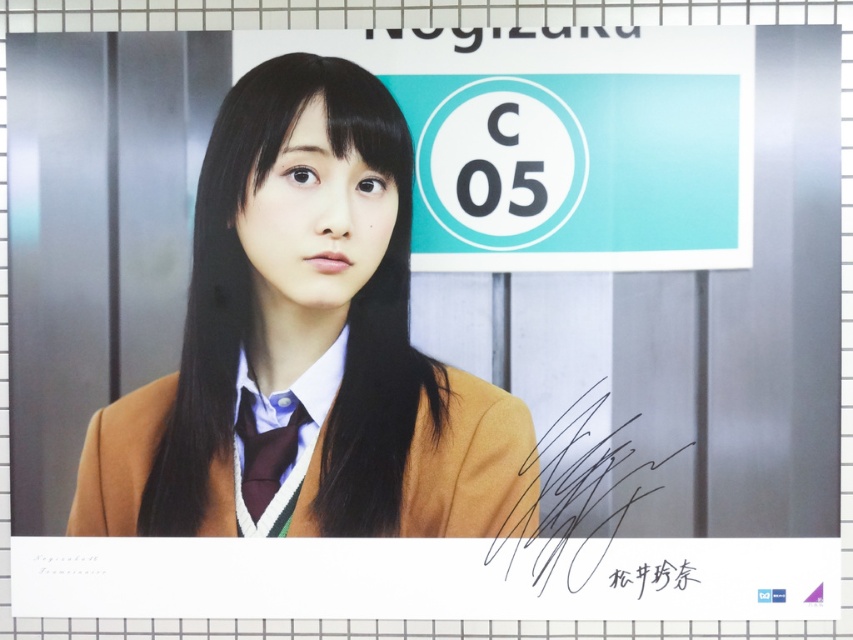
Question: Estimate the real-world distances between objects in this image. Which object is farther from the maroon satin tie at center?

Choices:
 (A) black ink signature at center
 (B) brown woolen sweater at center
 (C) black ink signature at lower right
 (D) matte brown blazer at center

Answer: (A)

Question: Can you confirm if brown woolen sweater at center is positioned below maroon satin tie at center?

Choices:
 (A) yes
 (B) no

Answer: (B)

Question: Which point is farther to the camera?

Choices:
 (A) (640, 595)
 (B) (512, 436)
 (C) (567, 484)

Answer: (B)

Question: Can you confirm if matte brown blazer at center is bigger than black ink signature at lower right?

Choices:
 (A) no
 (B) yes

Answer: (B)

Question: Among these points, which one is farthest from the camera?

Choices:
 (A) (207, 253)
 (B) (273, 474)

Answer: (A)

Question: Can you confirm if brown woolen sweater at center is positioned to the left of black ink signature at lower right?

Choices:
 (A) no
 (B) yes

Answer: (B)